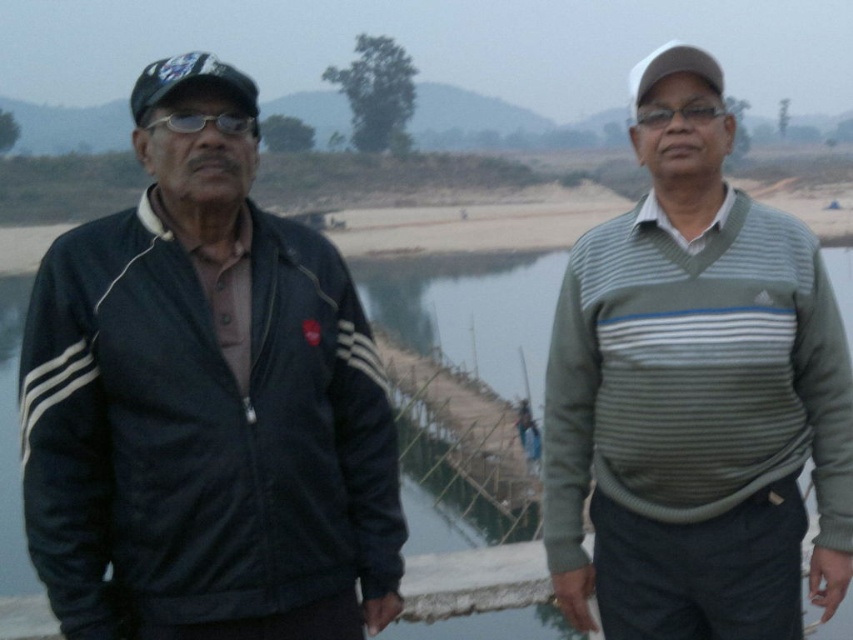
You are a photographer trying to capture a closeup of the matte black jacket at left. Which coordinate point should you focus on to ensure the jacket is centered in your shot?

You should focus on the coordinate point at (206, 403) to center the matte black jacket at left in your shot.

You are a photographer trying to capture both the matte black jacket at left and the striped sweater at center in a single frame. Which object should you focus on first to ensure both are in the frame?

Since the matte black jacket at left occupies less space than the striped sweater at center, you should focus on the striped sweater at center first to ensure both are in the frame.

You are a photographer trying to capture a clear shot of the two people in the scene. Since you want to focus on the person wearing the matte black jacket at left, which object should you position your camera closer to in order to avoid blurring the black matte glasses at left?

The matte black jacket at left is to the left of the black matte glasses at left, so positioning the camera closer to the left side will help keep the matte black jacket at left in focus while avoiding blurring the black matte glasses at left.